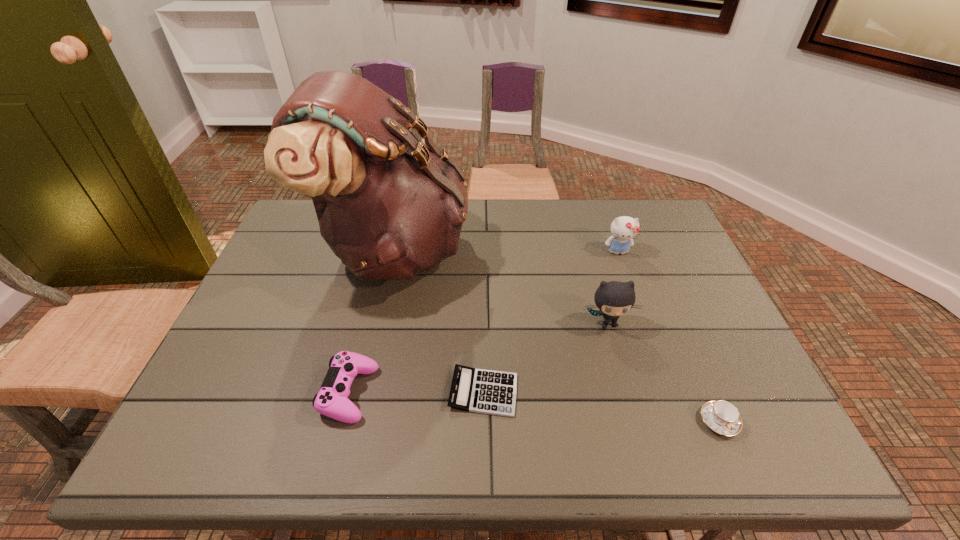
Identify the location of empty location between the farther kitten and the shortest object. (551, 322).

Locate an element on the screen. The width and height of the screenshot is (960, 540). free point between the third shortest object and the calculator is located at coordinates (417, 393).

The image size is (960, 540). In order to click on vacant space that's between the farther kitten and the shortest object in this screenshot , I will do `click(551, 322)`.

This screenshot has height=540, width=960. Find the location of `vacant space that is in between the nearer kitten and the calculator`. vacant space that is in between the nearer kitten and the calculator is located at coordinates (545, 357).

Find the location of `object that stands as the third closest to the calculator`. object that stands as the third closest to the calculator is located at coordinates (614, 298).

You are a GUI agent. You are given a task and a screenshot of the screen. Output one action in this format:
    pyautogui.click(x=<x>, y=<y>)
    Task: Click on the fifth closest object to the rightmost object
    
    Given the screenshot: What is the action you would take?
    pyautogui.click(x=331, y=401)

The width and height of the screenshot is (960, 540). In order to click on free space that satisfies the following two spatial constraints: 1. at the front of the tallest object with buckles; 2. on the left side of the shortest object in this screenshot , I will do `click(363, 392)`.